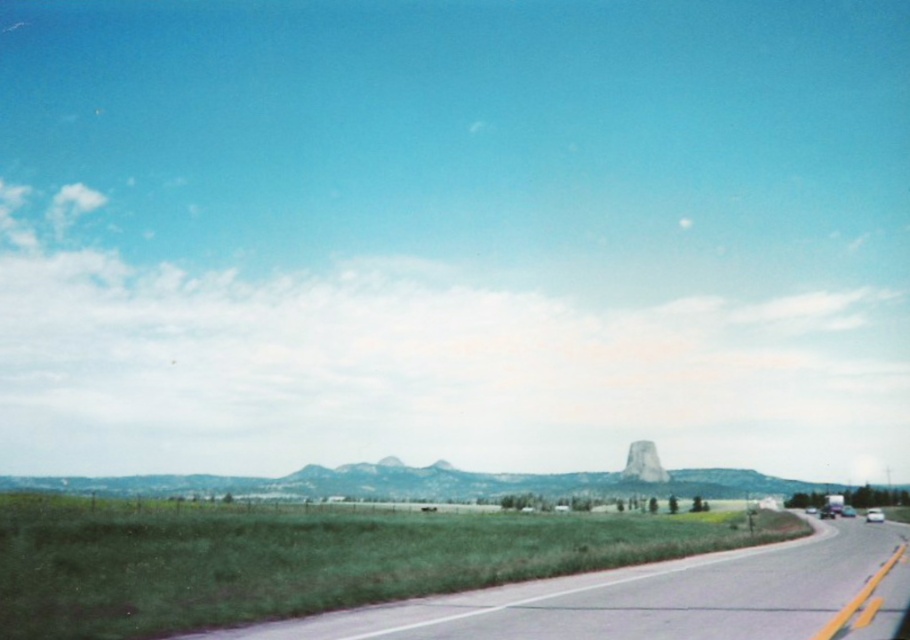
In the scene shown: You are driving a car and want to take a photo of the asphalt road at lower center and the white glossy car at right. Which object should you focus on first to ensure both are in the frame?

You should focus on the asphalt road at lower center first because it is closer to the viewer than the white glossy car at right, ensuring both are in the frame by adjusting the camera angle accordingly.

You are driving along the paved road in the rural landscape and see two points marked on your GPS. The first point is at coordinate point (645,460) and the second point is at coordinate point (880,515). Based on the scene description, which point is closer to you as you drive along the road?

Point (645,460) is behind point (880,515), so the point closer to you is point (880,515).